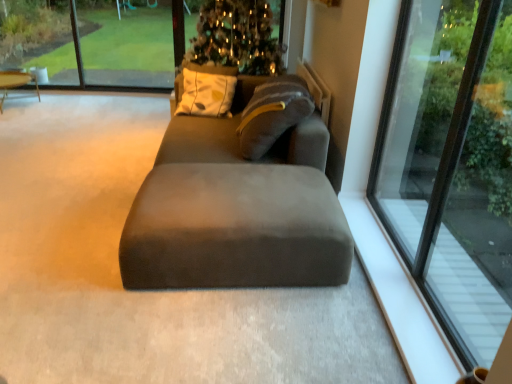
The height and width of the screenshot is (384, 512). What are the coordinates of `empty space that is to the right of matte brown table at left` in the screenshot? It's located at (58, 107).